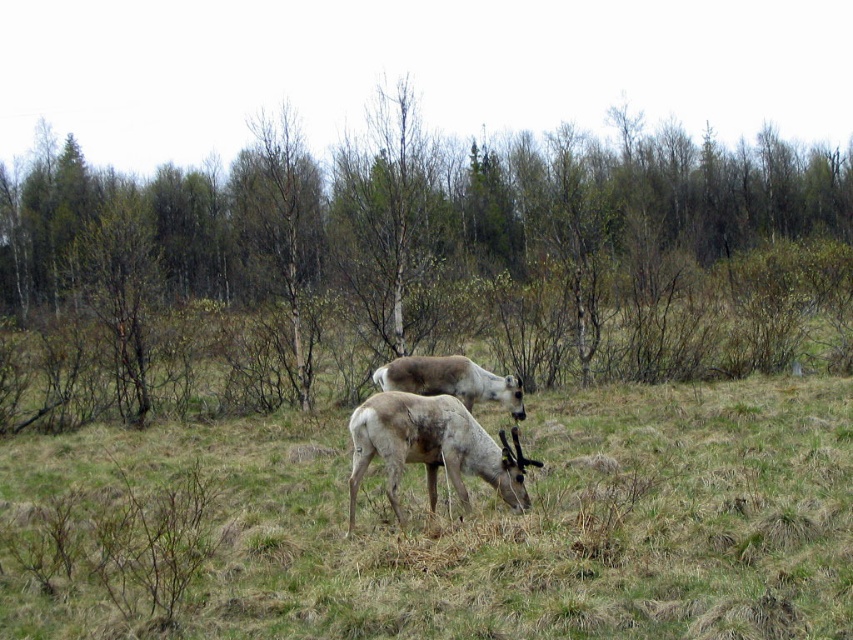
Question: Which object is the closest to the light brown fur at center?

Choices:
 (A) brown wood tree at center
 (B) grayish-brown fur at center
 (C) fuzzy brown reindeer at center

Answer: (C)

Question: Which of the following is the closest to the observer?

Choices:
 (A) fuzzy brown reindeer at center
 (B) light brown fur at center
 (C) brown wood tree at center
 (D) grayish-brown fur at center

Answer: (A)

Question: Which of the following is the closest to the observer?

Choices:
 (A) (625, 536)
 (B) (485, 461)
 (C) (778, 289)
 (D) (410, 381)

Answer: (A)

Question: Observing the image, what is the correct spatial positioning of brown wood tree at center in reference to fuzzy brown reindeer at center?

Choices:
 (A) right
 (B) left

Answer: (B)

Question: Does brown wood tree at center have a lesser width compared to grayish-brown fur at center?

Choices:
 (A) yes
 (B) no

Answer: (B)

Question: Can you confirm if fuzzy brown reindeer at center is positioned to the left of grayish-brown fur at center?

Choices:
 (A) no
 (B) yes

Answer: (B)